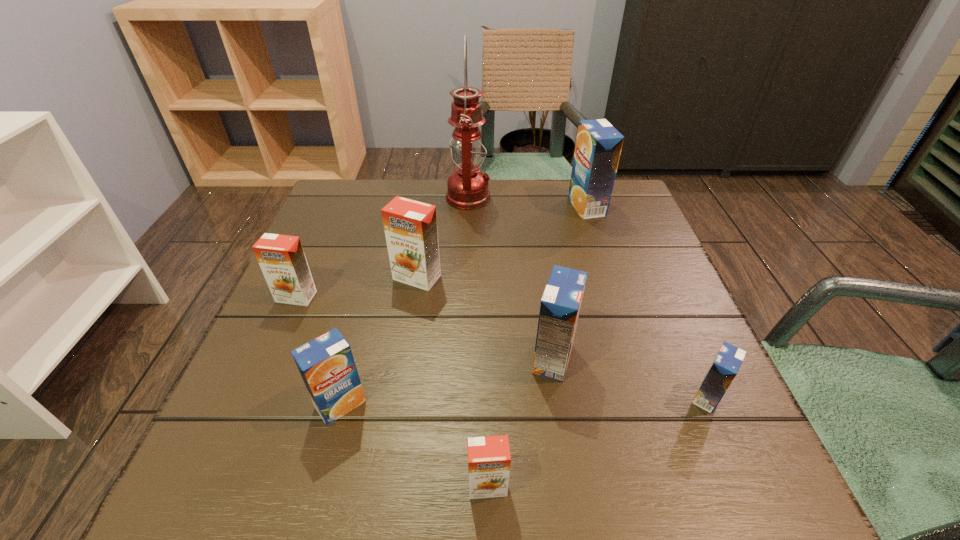
At what (x,y) coordinates should I click in order to perform the action: click on free space that satisfies the following two spatial constraints: 1. on the front side of the rightmost object; 2. on the left side of the seventh shortest object. Please return your answer as a coordinate pair (x, y). This screenshot has height=540, width=960. Looking at the image, I should click on (649, 397).